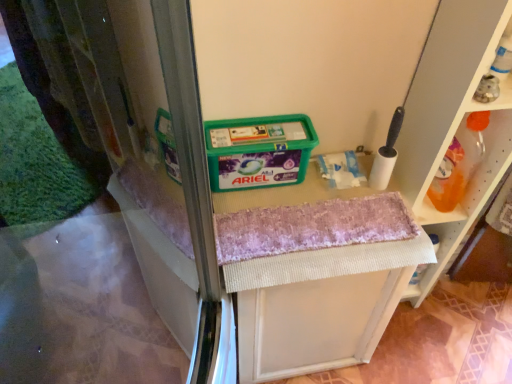
Describe the element at coordinates (312, 227) in the screenshot. I see `pink textured bath towel at center` at that location.

Measure the distance between point (231, 213) and camera.

Point (231, 213) and camera are 37.09 inches apart.

Describe the element at coordinates (319, 305) in the screenshot. I see `textured fabric vanity at center` at that location.

The width and height of the screenshot is (512, 384). Describe the element at coordinates (501, 144) in the screenshot. I see `translucent plastic bottle at upper right, the first shelf in the back-to-front sequence` at that location.

Locate an element on the screen. The image size is (512, 384). white foam brush at upper right is located at coordinates (386, 154).

Based on the photo, who is bigger, translucent plastic bottle at upper right, the first shelf in the back-to-front sequence, or pink textured bath towel at center?

pink textured bath towel at center is bigger.

Which is closer to the camera, (418, 222) or (326, 203)?

Point (418, 222) is farther from the camera than point (326, 203).

At what (x,y) coordinates should I click in order to perform the action: click on bath towel in front of the translucent plastic bottle at upper right, the first shelf in the back-to-front sequence. Please return your answer as a coordinate pair (x, y). This screenshot has width=512, height=384. Looking at the image, I should click on (312, 227).

What's the angular difference between translucent plastic bottle at upper right, acting as the second shelf starting from the front, and pink textured bath towel at center's facing directions?

The angular difference between translucent plastic bottle at upper right, acting as the second shelf starting from the front, and pink textured bath towel at center is 3.41 degrees.

Which of these two, white plastic shelf at right, arranged as the 2th shelf when viewed from the back, or textured fabric vanity at center, stands taller?

With more height is white plastic shelf at right, arranged as the 2th shelf when viewed from the back.

Is white plastic shelf at right, arranged as the 2th shelf when viewed from the back, thinner than textured fabric vanity at center?

Correct, the width of white plastic shelf at right, arranged as the 2th shelf when viewed from the back, is less than that of textured fabric vanity at center.

Between white plastic shelf at right, which is counted as the first shelf, starting from the front, and textured fabric vanity at center, which one has larger size?

With larger size is textured fabric vanity at center.

Does white plastic shelf at right, arranged as the 2th shelf when viewed from the back, appear on the left side of textured fabric vanity at center?

Incorrect, white plastic shelf at right, arranged as the 2th shelf when viewed from the back, is not on the left side of textured fabric vanity at center.

Is translucent plastic bottle at upper right, the first shelf in the back-to-front sequence, to the left of white foam brush at upper right from the viewer's perspective?

In fact, translucent plastic bottle at upper right, the first shelf in the back-to-front sequence, is to the right of white foam brush at upper right.

Considering the positions of point (432, 206) and point (380, 156), is point (432, 206) closer or farther from the camera than point (380, 156)?

Clearly, point (432, 206) is more distant from the camera than point (380, 156).

From a real-world perspective, which shelf is the 1st one underneath the white foam brush at upper right? Please provide its 2D coordinates.

[(501, 144)]

Do you think translucent plastic bottle at upper right, the first shelf in the back-to-front sequence, is within white foam brush at upper right, or outside of it?

The correct answer is: outside.

Considering the relative positions of translucent plastic bottle at upper right, the first shelf in the back-to-front sequence, and textured fabric vanity at center in the image provided, is translucent plastic bottle at upper right, the first shelf in the back-to-front sequence, to the left of textured fabric vanity at center from the viewer's perspective?

In fact, translucent plastic bottle at upper right, the first shelf in the back-to-front sequence, is to the right of textured fabric vanity at center.

Who is shorter, translucent plastic bottle at upper right, acting as the second shelf starting from the front, or textured fabric vanity at center?

translucent plastic bottle at upper right, acting as the second shelf starting from the front.

Are translucent plastic bottle at upper right, acting as the second shelf starting from the front, and textured fabric vanity at center beside each other?

No, translucent plastic bottle at upper right, acting as the second shelf starting from the front, is not beside textured fabric vanity at center.

Find the location of a particular element. vanity below the white plastic shelf at right, which is counted as the first shelf, starting from the front (from the image's perspective) is located at coordinates (319, 305).

Is point (364, 247) positioned behind point (415, 77)?

That is False.

Between textured fabric vanity at center and white plastic shelf at right, which is counted as the first shelf, starting from the front, which one is positioned behind?

textured fabric vanity at center is more distant.

Which of these two, pink textured bath towel at center or textured fabric vanity at center, stands taller?

textured fabric vanity at center.

Measure the distance from pink textured bath towel at center to textured fabric vanity at center.

pink textured bath towel at center is 6.70 inches away from textured fabric vanity at center.

From the image's perspective, is pink textured bath towel at center located above or below textured fabric vanity at center?

pink textured bath towel at center is situated higher than textured fabric vanity at center in the image.

From a real-world perspective, who is located lower, pink textured bath towel at center or textured fabric vanity at center?

textured fabric vanity at center is physically lower.

Which is farther from the camera, (x=241, y=368) or (x=428, y=216)?

Positioned behind is point (x=241, y=368).

Based on their positions, is textured fabric vanity at center located to the left or right of translucent plastic bottle at upper right, acting as the second shelf starting from the front?

textured fabric vanity at center is to the left of translucent plastic bottle at upper right, acting as the second shelf starting from the front.

Can you confirm if textured fabric vanity at center is bigger than translucent plastic bottle at upper right, acting as the second shelf starting from the front?

Indeed, textured fabric vanity at center has a larger size compared to translucent plastic bottle at upper right, acting as the second shelf starting from the front.

Does textured fabric vanity at center have a greater width compared to translucent plastic bottle at upper right, acting as the second shelf starting from the front?

Yes, textured fabric vanity at center is wider than translucent plastic bottle at upper right, acting as the second shelf starting from the front.

I want to click on bath towel located underneath the translucent plastic bottle at upper right, the first shelf in the back-to-front sequence (from a real-world perspective), so click(x=312, y=227).

The width and height of the screenshot is (512, 384). I want to click on vanity below the white plastic shelf at right, which is counted as the first shelf, starting from the front (from the image's perspective), so click(x=319, y=305).

Estimate the real-world distances between objects in this image. Which object is closer to pink textured bath towel at center, white plastic shelf at right, which is counted as the first shelf, starting from the front, or translucent plastic bottle at upper right, acting as the second shelf starting from the front?

white plastic shelf at right, which is counted as the first shelf, starting from the front, lies closer to pink textured bath towel at center than the other object.

Which object lies nearer to the anchor point white plastic shelf at right, which is counted as the first shelf, starting from the front, translucent plastic bottle at upper right, acting as the second shelf starting from the front, or pink textured bath towel at center?

Based on the image, translucent plastic bottle at upper right, acting as the second shelf starting from the front, appears to be nearer to white plastic shelf at right, which is counted as the first shelf, starting from the front.

Estimate the real-world distances between objects in this image. Which object is further from white plastic shelf at right, arranged as the 2th shelf when viewed from the back, translucent plastic bottle at upper right, the first shelf in the back-to-front sequence, or white foam brush at upper right?

white foam brush at upper right lies further to white plastic shelf at right, arranged as the 2th shelf when viewed from the back, than the other object.

Based on their spatial positions, is pink textured bath towel at center or textured fabric vanity at center further from translucent plastic bottle at upper right, acting as the second shelf starting from the front?

Based on the image, textured fabric vanity at center appears to be further to translucent plastic bottle at upper right, acting as the second shelf starting from the front.

Looking at this image, looking at the image, which one is located closer to pink textured bath towel at center, translucent plastic bottle at upper right, acting as the second shelf starting from the front, or white plastic shelf at right, which is counted as the first shelf, starting from the front?

Among the two, white plastic shelf at right, which is counted as the first shelf, starting from the front, is located nearer to pink textured bath towel at center.

When comparing their distances from pink textured bath towel at center, does white plastic shelf at right, which is counted as the first shelf, starting from the front, or textured fabric vanity at center seem closer?

The object closer to pink textured bath towel at center is textured fabric vanity at center.

Which object lies nearer to the anchor point white plastic shelf at right, which is counted as the first shelf, starting from the front, textured fabric vanity at center or translucent plastic bottle at upper right, acting as the second shelf starting from the front?

translucent plastic bottle at upper right, acting as the second shelf starting from the front, is closer to white plastic shelf at right, which is counted as the first shelf, starting from the front.

Looking at the image, which one is located further to white foam brush at upper right, pink textured bath towel at center or white plastic shelf at right, which is counted as the first shelf, starting from the front?

A: pink textured bath towel at center.

The image size is (512, 384). Identify the location of bath towel situated between textured fabric vanity at center and translucent plastic bottle at upper right, the first shelf in the back-to-front sequence, from left to right. (312, 227).

Identify the location of shelf situated between textured fabric vanity at center and translucent plastic bottle at upper right, acting as the second shelf starting from the front, from left to right. The height and width of the screenshot is (384, 512). (452, 122).

The height and width of the screenshot is (384, 512). Identify the location of brush between textured fabric vanity at center and translucent plastic bottle at upper right, the first shelf in the back-to-front sequence. (386, 154).

Where is `brush located between pink textured bath towel at center and white plastic shelf at right, arranged as the 2th shelf when viewed from the back, in the left-right direction`? This screenshot has height=384, width=512. brush located between pink textured bath towel at center and white plastic shelf at right, arranged as the 2th shelf when viewed from the back, in the left-right direction is located at coordinates (386, 154).